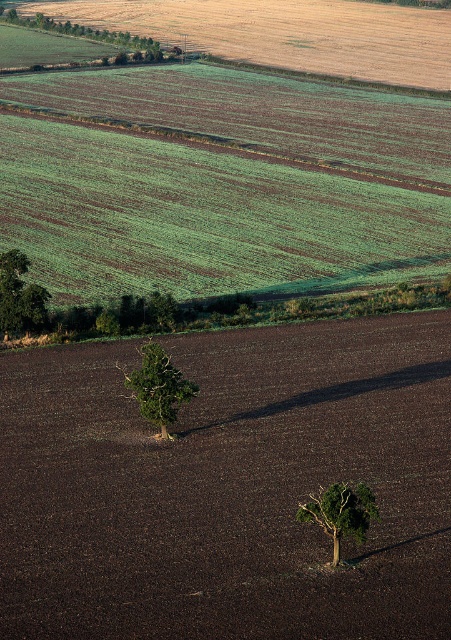
In the scene shown: Does green grassy field at center have a larger size compared to green matte tree at center?

Yes, green grassy field at center is bigger than green matte tree at center.

Does green grassy field at center appear on the right side of green matte tree at center?

Incorrect, green grassy field at center is not on the right side of green matte tree at center.

Is point (334, 112) positioned in front of point (363, 486)?

No.

This screenshot has width=451, height=640. I want to click on green grassy field at center, so click(220, 182).

Which is more to the right, green matte tree at center-left or green matte tree at center?

green matte tree at center is more to the right.

Locate an element on the screen. green matte tree at center-left is located at coordinates (157, 387).

Is point (196, 387) positioned in front of point (351, 531)?

No, (196, 387) is further to viewer.

Identify the location of green matte tree at center-left. (157, 387).

Is green leafy tree at center above green leafy tree at left?

No.

Is green leafy tree at center further to camera compared to green leafy tree at left?

No, it is in front of green leafy tree at left.

Does point (426, 616) come in front of point (1, 259)?

That is True.

Where is `green leafy tree at center`? The width and height of the screenshot is (451, 640). green leafy tree at center is located at coordinates (229, 486).